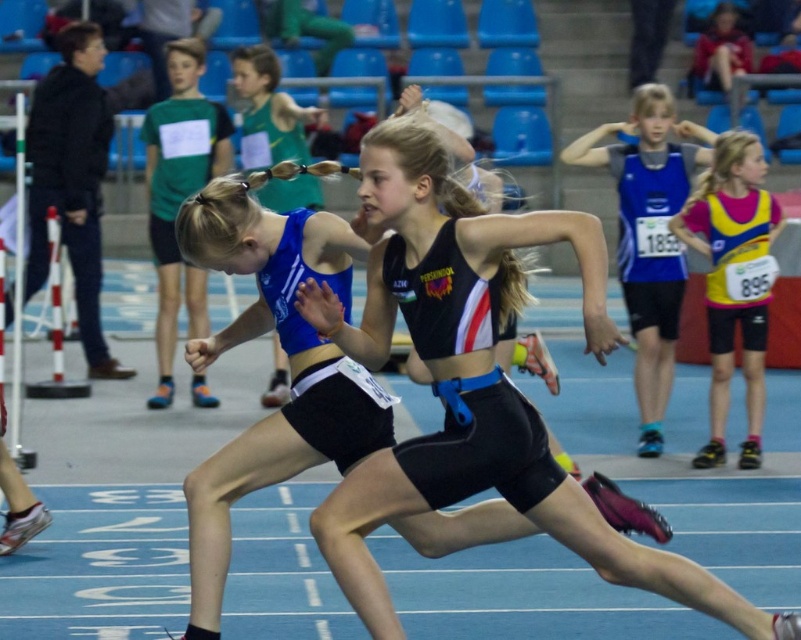
Between point (541, 476) and point (45, 202), which one is positioned in front?

Point (541, 476) is in front.

Is black matte running suit at center smaller than matte black shorts at left?

Incorrect, black matte running suit at center is not smaller in size than matte black shorts at left.

At what (x,y) coordinates should I click in order to perform the action: click on black matte running suit at center. Please return your answer as a coordinate pair (x, y). This screenshot has height=640, width=801. Looking at the image, I should click on (473, 381).

Is blue jersey at center further to the viewer compared to matte black shorts at left?

No, blue jersey at center is closer to the viewer.

Can you confirm if blue jersey at center is smaller than matte black shorts at left?

Indeed, blue jersey at center has a smaller size compared to matte black shorts at left.

Is point (667, 205) positioned before point (38, 244)?

Yes.

Where is `blue jersey at center`? The width and height of the screenshot is (801, 640). blue jersey at center is located at coordinates (649, 237).

Who is more distant from viewer, [643,164] or [761,212]?

The point [643,164] is behind.

Does blue jersey at center appear on the right side of yellow and pink jersey at right?

No, blue jersey at center is not to the right of yellow and pink jersey at right.

Is point (634, 214) positioned after point (715, 374)?

Yes, it is.

Where is `blue jersey at center`? This screenshot has height=640, width=801. blue jersey at center is located at coordinates (649, 237).